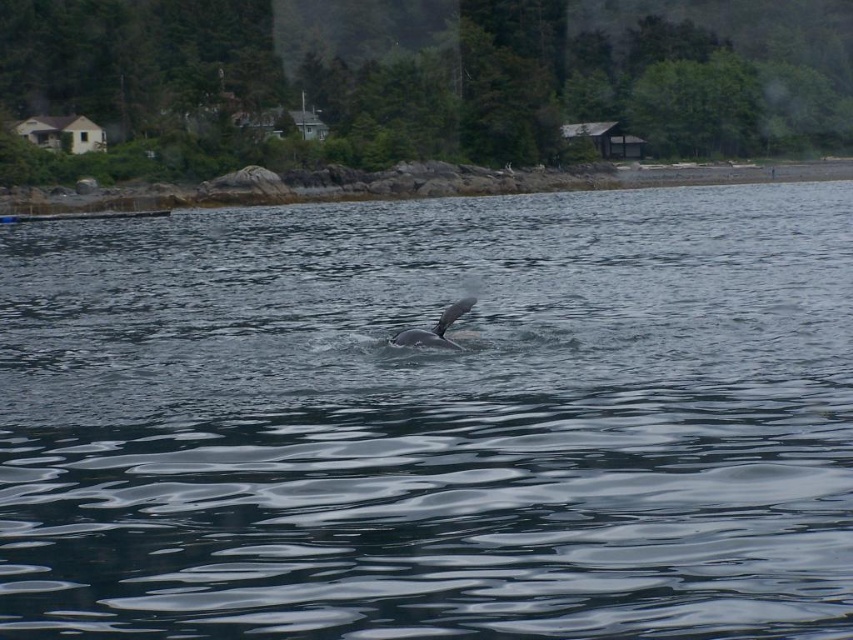
You are a marine biologist observing the coastal scene. You notice the dark gray water at center and the gray smooth whale at center. Which object occupies a larger area in the image?

The dark gray water at center is bigger than the gray smooth whale at center, so the dark gray water at center occupies a larger area in the image.

You are a marine biologist observing the coastal scene. You notice the dark gray water at center and the gray smooth whale at center. Which object is higher above the water surface?

The dark gray water at center is taller than the gray smooth whale at center.